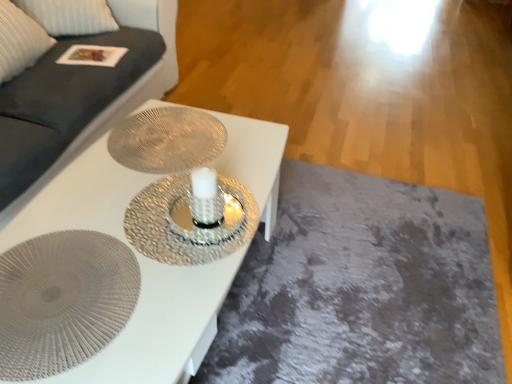
Where is `free space above textured silver plate at center, which is counted as the second oval, starting from the back (from a real-world perspective)`? free space above textured silver plate at center, which is counted as the second oval, starting from the back (from a real-world perspective) is located at coordinates (67, 287).